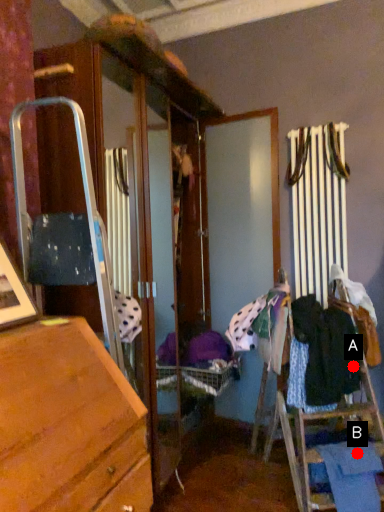
Question: Two points are circled on the image, labeled by A and B beside each circle. Which point is farther to the camera?

Choices:
 (A) A is further
 (B) B is further

Answer: (A)